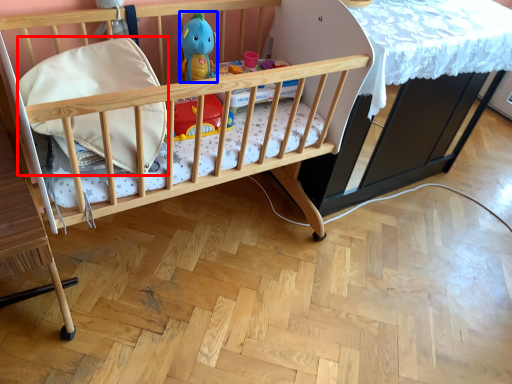
Question: Which object is closer to the camera taking this photo, pillow (highlighted by a red box) or toy (highlighted by a blue box)?

Choices:
 (A) pillow
 (B) toy

Answer: (A)